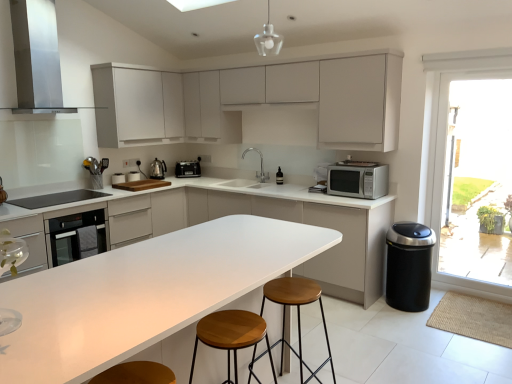
Measure the distance between point (154, 160) and camera.

Point (154, 160) and camera are 4.94 meters apart.

At what (x,y) coordinates should I click in order to perform the action: click on white laminate countertop at center. Please return your answer as a coordinate pair (x, y). The width and height of the screenshot is (512, 384). Looking at the image, I should click on click(144, 293).

Image resolution: width=512 pixels, height=384 pixels. What do you see at coordinates (57, 198) in the screenshot? I see `black glass cooktop at left` at bounding box center [57, 198].

Identify the location of stainless steel range hood at upper left. (37, 56).

Is stainless steel range hood at upper left to the left or to the right of wooden stool at center, arranged as the second stool when viewed from the back, in the image?

stainless steel range hood at upper left is to the left of wooden stool at center, arranged as the second stool when viewed from the back.

Is stainless steel range hood at upper left turned away from wooden stool at center, the 1th stool from the front?

No.

Considering the relative positions of stainless steel range hood at upper left and wooden stool at center, arranged as the second stool when viewed from the back, in the image provided, is stainless steel range hood at upper left in front of wooden stool at center, arranged as the second stool when viewed from the back,?

That is False.

Where is `cabinetry that is the 1st one when counting backward from the matte glass pendant at upper center`? This screenshot has height=384, width=512. cabinetry that is the 1st one when counting backward from the matte glass pendant at upper center is located at coordinates (339, 244).

In the image, is white matte cabinet at center, placed as the 1th cabinetry when sorted from bottom to top, positioned in front of or behind matte glass pendant at upper center?

white matte cabinet at center, placed as the 1th cabinetry when sorted from bottom to top, is positioned farther from the viewer than matte glass pendant at upper center.

Based on their sizes in the image, would you say white matte cabinet at center, placed as the 1th cabinetry when sorted from bottom to top, is bigger or smaller than matte glass pendant at upper center?

Considering their sizes, white matte cabinet at center, placed as the 1th cabinetry when sorted from bottom to top, takes up more space than matte glass pendant at upper center.

Is white matte cabinet at center, the third cabinetry when ordered from top to bottom, oriented towards matte glass pendant at upper center?

No.

How much distance is there between wooden stool at center, the second stool in the front-to-back sequence, and white matte cabinet at upper center, positioned as the second cabinetry in bottom-to-top order?

A distance of 7.37 feet exists between wooden stool at center, the second stool in the front-to-back sequence, and white matte cabinet at upper center, positioned as the second cabinetry in bottom-to-top order.

From the image's perspective, which one is positioned lower, wooden stool at center, the second stool in the front-to-back sequence, or white matte cabinet at upper center, positioned as the second cabinetry in bottom-to-top order?

wooden stool at center, the second stool in the front-to-back sequence, is shown below in the image.

From a real-world perspective, relative to white matte cabinet at upper center, which is the second cabinetry in top-to-bottom order, is wooden stool at center, the second stool in the front-to-back sequence, vertically above or below?

In terms of real-world spatial position, wooden stool at center, the second stool in the front-to-back sequence, is below white matte cabinet at upper center, which is the second cabinetry in top-to-bottom order.

Does point (279, 279) appear closer or farther from the camera than point (355, 104)?

Point (279, 279).

Which is closer to the camera, (283, 279) or (24, 200)?

The point (283, 279) is closer.

From a real-world perspective, is wooden stool at center, the second stool in the front-to-back sequence, on top of black glass cooktop at left?

No.

In the scene shown: Who is shorter, wooden stool at center, the second stool in the front-to-back sequence, or black glass cooktop at left?

Standing shorter between the two is black glass cooktop at left.

How distant is wooden stool at center, the second stool in the front-to-back sequence, from black glass cooktop at left?

A distance of 2.36 meters exists between wooden stool at center, the second stool in the front-to-back sequence, and black glass cooktop at left.

From the image's perspective, is transparent glass door at right located beneath matte glass pendant at upper center?

Correct, transparent glass door at right appears lower than matte glass pendant at upper center in the image.

Looking at this image, considering their positions, is transparent glass door at right located in front of or behind matte glass pendant at upper center?

transparent glass door at right is positioned farther from the viewer than matte glass pendant at upper center.

Considering the positions of point (457, 179) and point (272, 27), is point (457, 179) closer or farther from the camera than point (272, 27)?

Clearly, point (457, 179) is more distant from the camera than point (272, 27).

Which stool is the 2nd one when counting from the right side of the white laminate countertop at center? Please provide its 2D coordinates.

[(297, 314)]

Can you see white laminate countertop at center touching wooden stool at center, the 1th stool in the back-to-front sequence?

No, white laminate countertop at center is not making contact with wooden stool at center, the 1th stool in the back-to-front sequence.

From a real-world perspective, is white laminate countertop at center located higher than wooden stool at center, the 1th stool in the back-to-front sequence?

Yes, from a real-world perspective, white laminate countertop at center is above wooden stool at center, the 1th stool in the back-to-front sequence.

Does white laminate countertop at center contain wooden stool at center, the second stool in the front-to-back sequence?

Yes, wooden stool at center, the second stool in the front-to-back sequence, can be found within white laminate countertop at center.

Locate an element on the screen. Image resolution: width=512 pixels, height=384 pixels. the 2nd stool directly beneath the satin silver microwave at right (from a real-world perspective) is located at coordinates (297, 314).

Are satin silver microwave at right and wooden stool at center, the 1th stool in the back-to-front sequence, far apart?

Indeed, satin silver microwave at right is not near wooden stool at center, the 1th stool in the back-to-front sequence.

From the image's perspective, who appears lower, satin silver microwave at right or wooden stool at center, the 1th stool in the back-to-front sequence?

wooden stool at center, the 1th stool in the back-to-front sequence, appears lower in the image.

Locate an element on the screen. Image resolution: width=512 pixels, height=384 pixels. the 1st stool below the stainless steel range hood at upper left (from the image's perspective) is located at coordinates (231, 336).

Where is `light fixture located on the right of white matte cabinet at center, placed as the 1th cabinetry when sorted from bottom to top`? This screenshot has width=512, height=384. light fixture located on the right of white matte cabinet at center, placed as the 1th cabinetry when sorted from bottom to top is located at coordinates (268, 39).

Looking at the image, which one is located further to satin silver microwave at right, polished stainless steel kettle at center-left, which appears as the second appliance when viewed from the right, or white laminate countertop at center?

polished stainless steel kettle at center-left, which appears as the second appliance when viewed from the right.

Looking at the image, which one is located further to black glass cooktop at left, wooden stool at center, the 1th stool from the front, or wooden stool at center, the second stool in the front-to-back sequence?

wooden stool at center, the 1th stool from the front, is further to black glass cooktop at left.

Estimate the real-world distances between objects in this image. Which object is further from white laminate countertop at center, wooden stool at center, the second stool in the front-to-back sequence, or white matte cabinet at center, placed as the 1th cabinetry when sorted from bottom to top?

white matte cabinet at center, placed as the 1th cabinetry when sorted from bottom to top.

Based on their spatial positions, is black glass cooktop at left or stainless steel range hood at upper left closer to wooden stool at center, arranged as the second stool when viewed from the back?

Based on the image, black glass cooktop at left appears to be nearer to wooden stool at center, arranged as the second stool when viewed from the back.

When comparing their distances from polished stainless steel kettle at center-left, which appears as the second appliance when viewed from the right, does black glass cooktop at left or transparent glass door at right seem closer?

black glass cooktop at left.

Based on their spatial positions, is matte glass pendant at upper center or white matte cabinet at center, placed as the 1th cabinetry when sorted from bottom to top, further from stainless steel range hood at upper left?

white matte cabinet at center, placed as the 1th cabinetry when sorted from bottom to top, is positioned further to the anchor stainless steel range hood at upper left.

Considering their positions, is matte glass pendant at upper center positioned closer to silver metallic faucet at center than satin black toaster at center, arranged as the second appliance when viewed from the left?

The object closer to silver metallic faucet at center is satin black toaster at center, arranged as the second appliance when viewed from the left.

Which object lies nearer to the anchor point stainless steel range hood at upper left, matte glass pendant at upper center or wooden stool at center, the second stool in the front-to-back sequence?

The object closer to stainless steel range hood at upper left is matte glass pendant at upper center.

Image resolution: width=512 pixels, height=384 pixels. I want to click on light fixture between wooden stool at center, the 1th stool in the back-to-front sequence, and polished stainless steel kettle at center-left, which appears as the second appliance when viewed from the right, from front to back, so click(268, 39).

I want to click on stool situated between matte glass pendant at upper center and transparent glass door at right from left to right, so click(x=297, y=314).

Where is `cabinetry between white matte cabinet at center, the third cabinetry when ordered from top to bottom, and polished stainless steel kettle at center-left, the first appliance viewed from the left, in the front-back direction`? Image resolution: width=512 pixels, height=384 pixels. cabinetry between white matte cabinet at center, the third cabinetry when ordered from top to bottom, and polished stainless steel kettle at center-left, the first appliance viewed from the left, in the front-back direction is located at coordinates (137, 106).

I want to click on light fixture between white matte cabinet at upper center, positioned as the second cabinetry in bottom-to-top order, and transparent glass door at right, so click(268, 39).